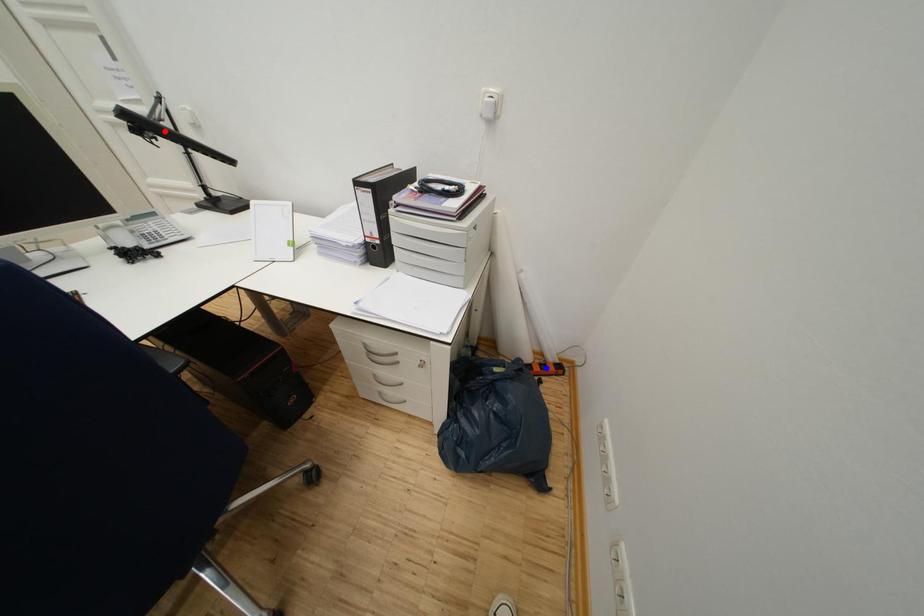
Question: Which of the two points in the image is closer to the camera?

Choices:
 (A) Blue point is closer.
 (B) Red point is closer.

Answer: (B)